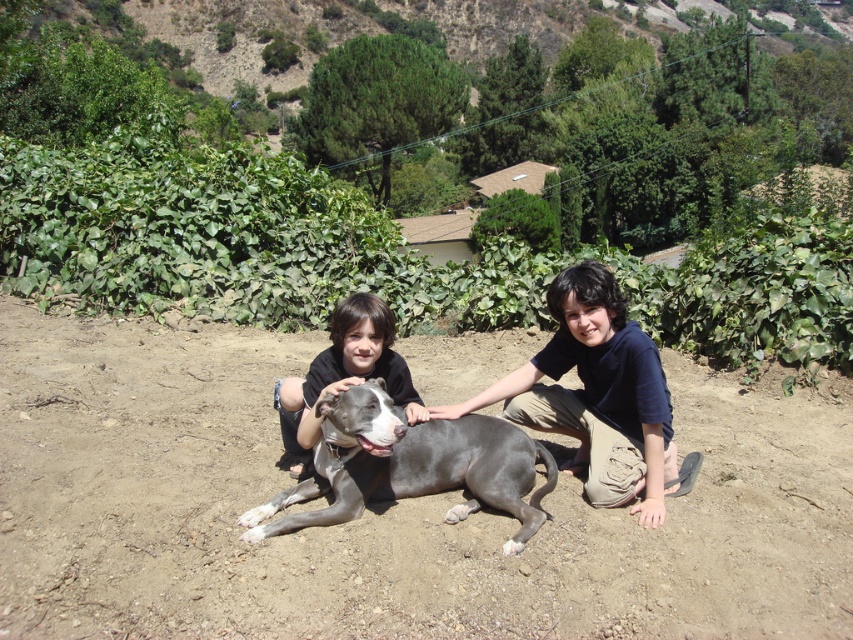
You are a photographer standing at the edge of the dirt path. You want to take a photo of the gray smooth dog at center and the matte black shirt at center. Based on their positions, which object will appear larger in your photo?

The gray smooth dog at center will appear larger in the photo because it is closer to the viewer than the matte black shirt at center.

You are a photographer trying to capture a closeup of the gray smooth dog at center and the matte black shirt at center. Given their distance, can you frame both subjects within a 15 inch wide camera viewfinder?

The gray smooth dog at center is 12.47 inches from matte black shirt at center, so yes, both subjects can be framed within a 15 inch wide camera viewfinder since the distance between them is less than the viewfinder width.